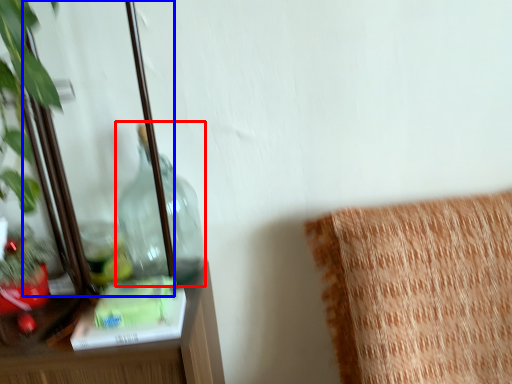
Question: Which of the following is the closest to the observer, bottle (highlighted by a red box) or mirror (highlighted by a blue box)?

Choices:
 (A) bottle
 (B) mirror

Answer: (B)